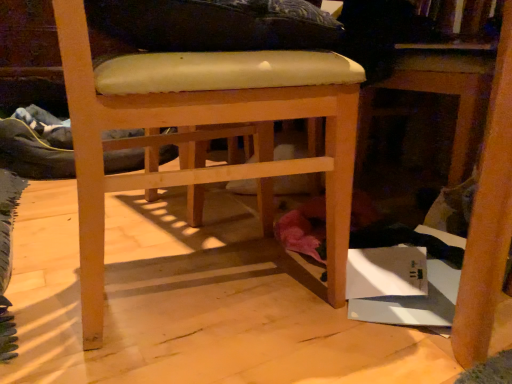
At what (x,y) coordinates should I click in order to perform the action: click on vacant space underneath light brown wood chair at center (from a real-world perspective). Please return your answer as a coordinate pair (x, y). The width and height of the screenshot is (512, 384). Looking at the image, I should click on (196, 290).